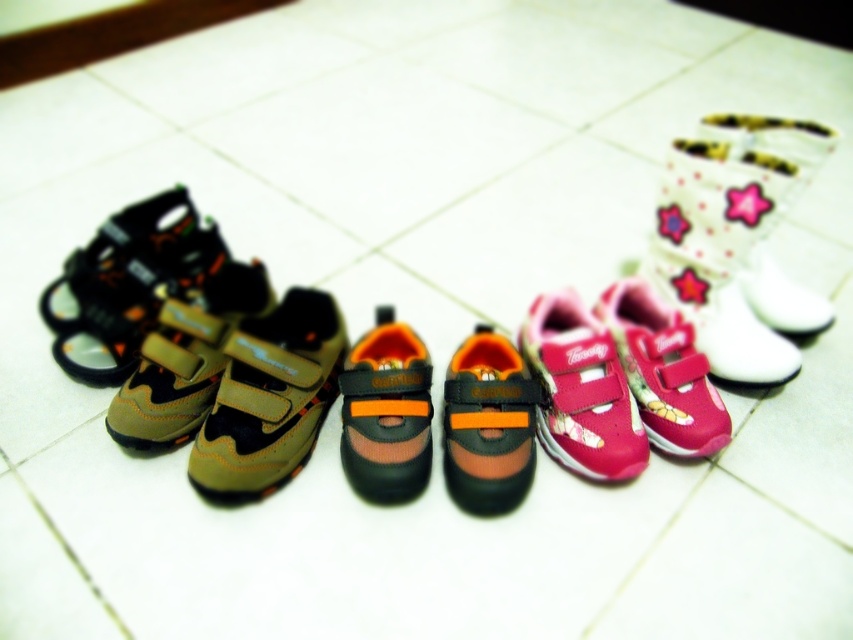
Which is behind, point (149, 400) or point (418, 342)?

Positioned behind is point (418, 342).

Who is taller, matte brown fabric shoe at left or orange mesh shoe at center?

Standing taller between the two is orange mesh shoe at center.

Is point (241, 298) farther from viewer compared to point (415, 346)?

Yes, it is behind point (415, 346).

Where is `matte brown fabric shoe at left`? matte brown fabric shoe at left is located at coordinates (184, 358).

Can you confirm if matte khaki shoe at center is positioned below orange fabric shoe at center?

Correct, matte khaki shoe at center is located below orange fabric shoe at center.

Identify the location of matte khaki shoe at center. This screenshot has height=640, width=853. (270, 396).

Locate an element on the screen. The image size is (853, 640). matte khaki shoe at center is located at coordinates coord(270,396).

Does matte khaki shoe at center have a greater height compared to matte brown fabric shoe at left?

Yes.

Who is positioned more to the left, matte khaki shoe at center or matte brown fabric shoe at left?

matte brown fabric shoe at left is more to the left.

Between point (236, 442) and point (123, 442), which one is positioned behind?

The point (123, 442) is behind.

At what (x,y) coordinates should I click in order to perform the action: click on matte khaki shoe at center. Please return your answer as a coordinate pair (x, y). Image resolution: width=853 pixels, height=640 pixels. Looking at the image, I should click on pos(270,396).